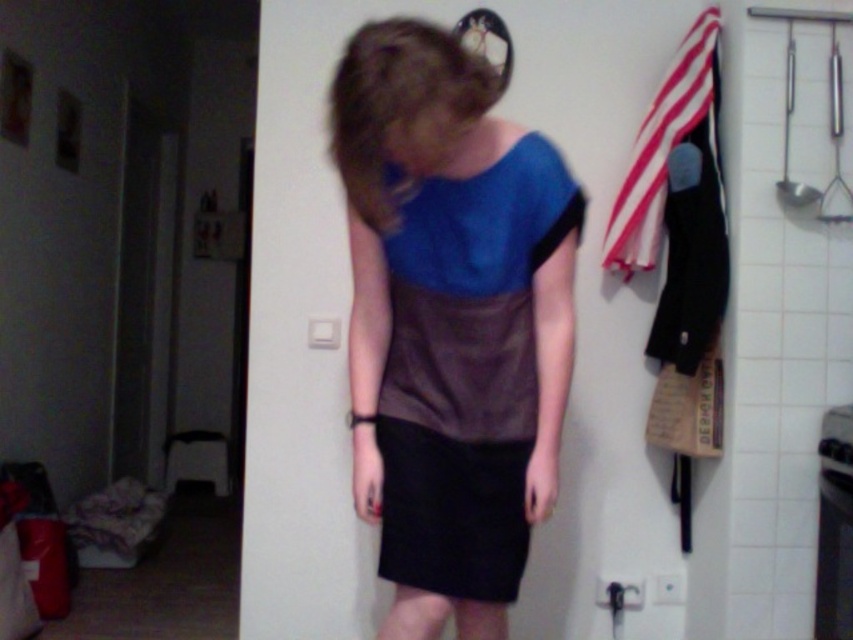
Does matte blue fabric at center have a greater height compared to black matte skirt at center?

Yes.

Does point (363, 83) come farther from viewer compared to point (415, 584)?

No, (363, 83) is closer to viewer.

The height and width of the screenshot is (640, 853). What are the coordinates of `matte blue fabric at center` in the screenshot? It's located at (450, 323).

Find the location of a particular element. The width and height of the screenshot is (853, 640). black matte skirt at center is located at coordinates (451, 513).

Does black matte skirt at center have a greater height compared to red striped fabric at upper right?

Incorrect, black matte skirt at center's height is not larger of red striped fabric at upper right's.

What do you see at coordinates (451, 513) in the screenshot? The image size is (853, 640). I see `black matte skirt at center` at bounding box center [451, 513].

Find the location of a particular element. black matte skirt at center is located at coordinates (451, 513).

Who is higher up, matte blue fabric at center or red striped fabric at upper right?

red striped fabric at upper right

Between matte blue fabric at center and red striped fabric at upper right, which one appears on the left side from the viewer's perspective?

From the viewer's perspective, matte blue fabric at center appears more on the left side.

Where is `matte blue fabric at center`? The image size is (853, 640). matte blue fabric at center is located at coordinates [x=450, y=323].